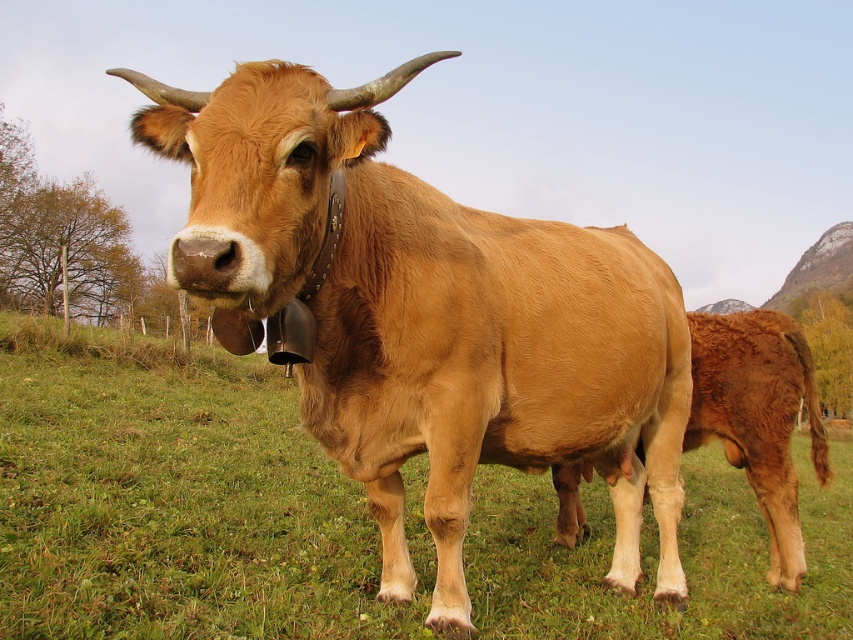
You are a farmer checking the field. You see the green grass at center and the shiny brown cow at center. Which one is taller?

The green grass at center is taller than the shiny brown cow at center.

Based on the scene description, can you determine which object is taller between the green grass at center and the brown smooth cow at lower right?

The green grass at center is taller than the brown smooth cow at lower right according to the description.

You are a farmer checking the field. You see the green grass at center and the shiny brown cow at center. Which object is located lower in the image?

The green grass at center is located lower than the shiny brown cow at center in the image.